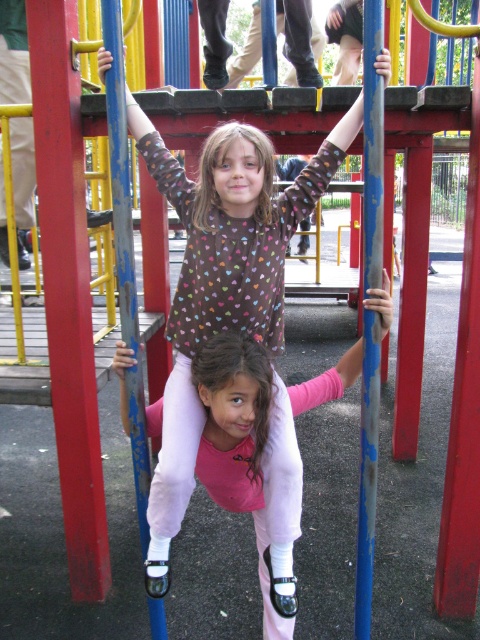
Can you confirm if brown dotted sweater at center is smaller than blue painted metal pole at center?

No, brown dotted sweater at center is not smaller than blue painted metal pole at center.

Is brown dotted sweater at center bigger than blue painted metal pole at center?

Yes.

I want to click on brown dotted sweater at center, so click(222, 280).

The image size is (480, 640). In order to click on brown dotted sweater at center in this screenshot , I will do `click(222, 280)`.